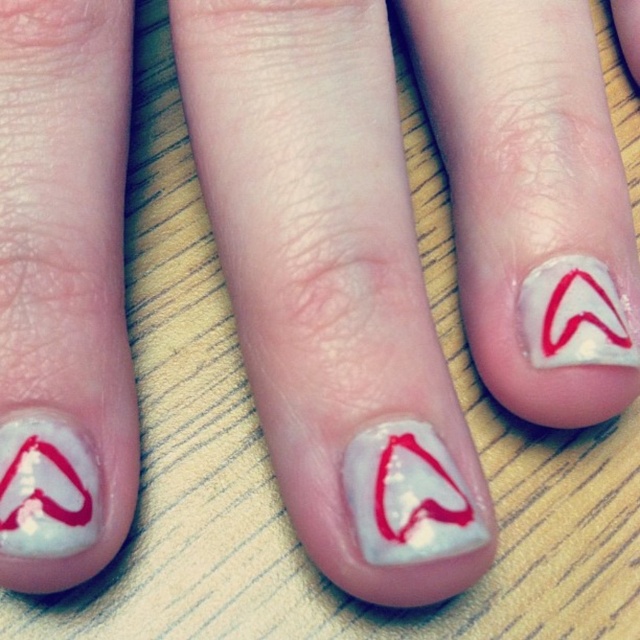
You are a nail technician observing the image. You need to place a new heart design on the white glossy nail at center. Based on the existing white glossy heart at center, will the new heart fit vertically on the nail without overlapping the edges?

The white glossy nail at center has a greater height compared to the white glossy heart at center, so the new heart design will fit vertically on the nail without overlapping the edges since the nail is taller than the existing heart.

You are a nail technician observing the image. You need to place a new heart design on the white glossy nail at center. Where should you position it so it aligns with the existing white glossy heart at upper right?

The white glossy nail at center is above the white glossy heart at upper right, so to align the new heart design with the existing one, position it below the white glossy heart at upper right.